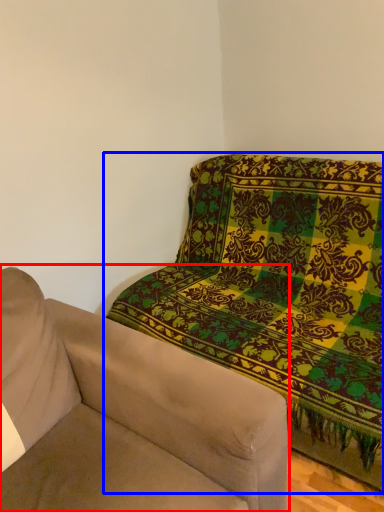
Question: Which point is closer to the camera, studio couch (highlighted by a red box) or studio sofa (highlighted by a blue box)?

Choices:
 (A) studio couch
 (B) studio sofa

Answer: (A)